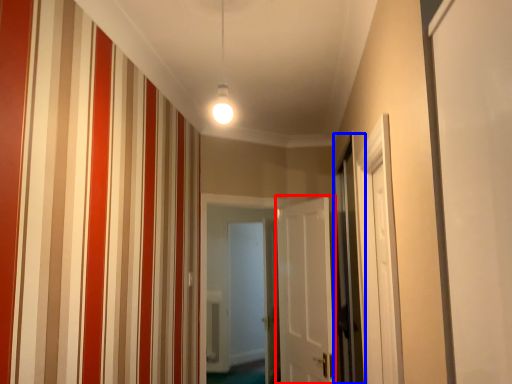
Question: Which object is further to the camera taking this photo, door (highlighted by a red box) or screen door (highlighted by a blue box)?

Choices:
 (A) door
 (B) screen door

Answer: (A)